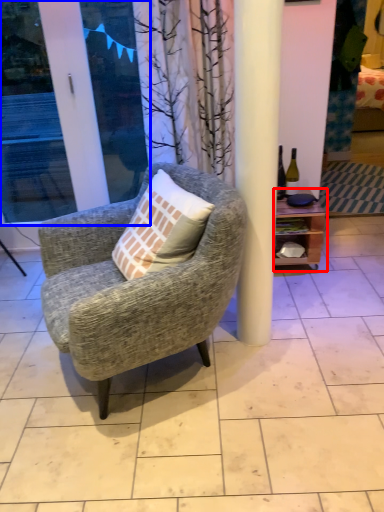
Question: Which of the following is the closest to the observer, shelf (highlighted by a red box) or screen door (highlighted by a blue box)?

Choices:
 (A) shelf
 (B) screen door

Answer: (B)